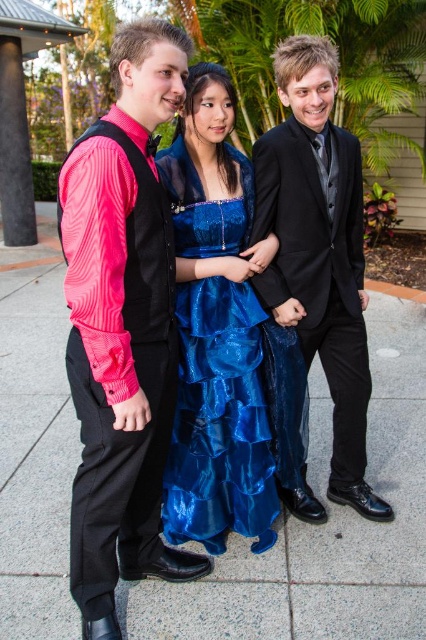
Question: Does pink striped shirt at left appear on the left side of black satin suit at center?

Choices:
 (A) yes
 (B) no

Answer: (A)

Question: Which object is positioned farthest from the pink striped shirt at left?

Choices:
 (A) slate gray pavement at center
 (B) shiny blue dress at center
 (C) black satin suit at center

Answer: (A)

Question: Which object is the farthest from the black satin suit at center?

Choices:
 (A) pink striped shirt at left
 (B) slate gray pavement at center
 (C) shiny blue dress at center

Answer: (B)

Question: Which of the following is the farthest from the observer?

Choices:
 (A) black satin suit at center
 (B) shiny blue dress at center
 (C) slate gray pavement at center
 (D) pink striped shirt at left

Answer: (A)

Question: Is shiny blue dress at center bigger than black satin suit at center?

Choices:
 (A) yes
 (B) no

Answer: (B)

Question: Is slate gray pavement at center wider than shiny blue dress at center?

Choices:
 (A) no
 (B) yes

Answer: (B)